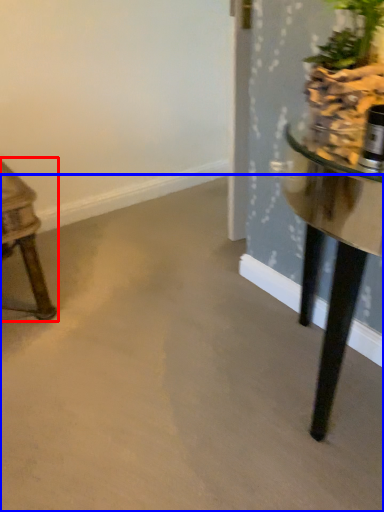
Question: Which object appears farthest to the camera in this image, table (highlighted by a red box) or concrete (highlighted by a blue box)?

Choices:
 (A) table
 (B) concrete

Answer: (A)